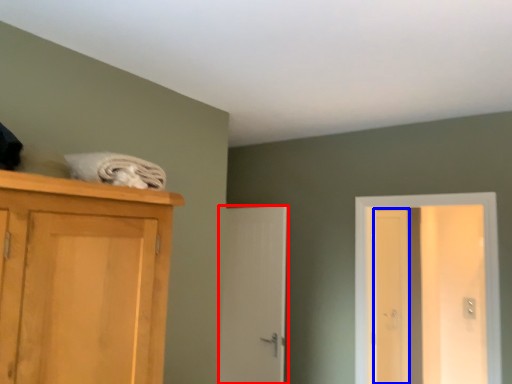
Question: Among these objects, which one is nearest to the camera, door (highlighted by a red box) or screen door (highlighted by a blue box)?

Choices:
 (A) door
 (B) screen door

Answer: (A)